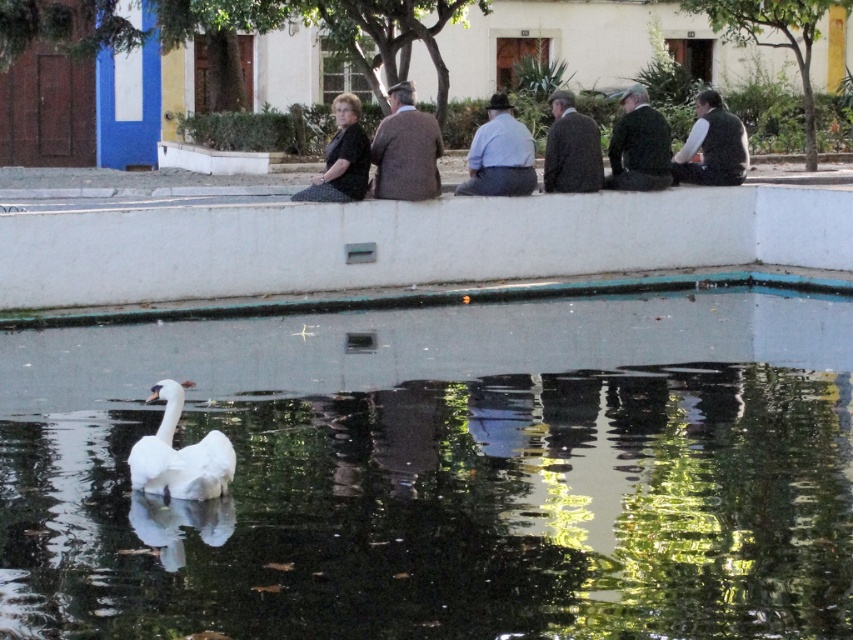
Question: Does white concrete ledge at center appear on the right side of green textured vest at right?

Choices:
 (A) yes
 (B) no

Answer: (B)

Question: Estimate the real-world distances between objects in this image. Which object is farther from the brown wool sweater at center?

Choices:
 (A) black dotted dress at center
 (B) dark brown wool coat at center
 (C) clear glass pool at center
 (D) white feathered swan at lower left

Answer: (C)

Question: Can you confirm if clear glass pool at center is positioned to the right of dark brown wool coat at center?

Choices:
 (A) yes
 (B) no

Answer: (B)

Question: Does clear glass pool at center have a smaller size compared to dark green fabric jacket at center?

Choices:
 (A) yes
 (B) no

Answer: (A)

Question: Which point appears farthest from the camera in this image?

Choices:
 (A) (363, 176)
 (B) (555, 161)
 (C) (376, 189)
 (D) (709, 136)

Answer: (D)

Question: Estimate the real-world distances between objects in this image. Which object is farther from the green textured vest at right?

Choices:
 (A) light blue shirt at center
 (B) brown wool sweater at center
 (C) white feathered swan at lower left
 (D) dark green fabric jacket at center

Answer: (C)